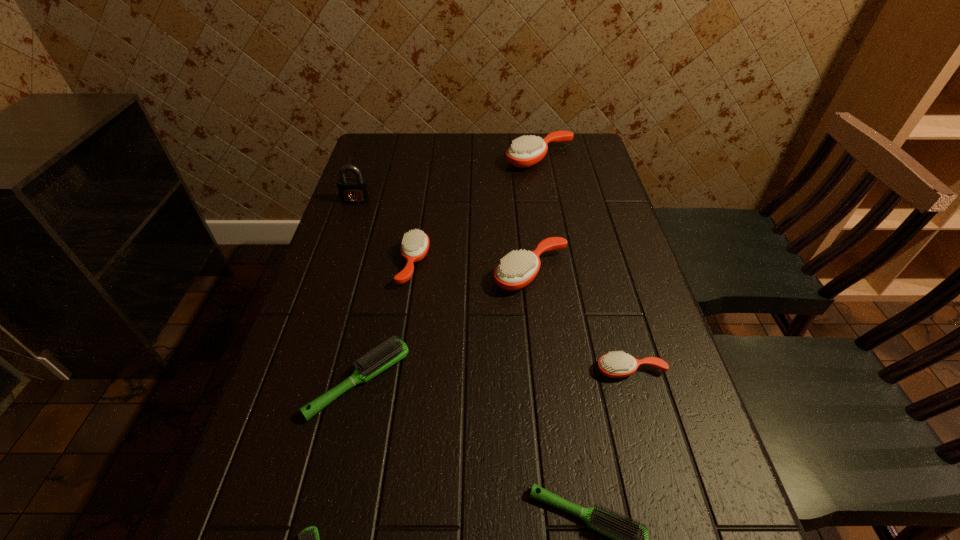
Find the location of `free location at the far edge`. free location at the far edge is located at coordinates (543, 161).

Where is `free space at the left edge of the desktop`? free space at the left edge of the desktop is located at coordinates (321, 429).

In the image, there is a desktop. At what (x,y) coordinates should I click in order to perform the action: click on free space at the right edge. Please return your answer as a coordinate pair (x, y). Looking at the image, I should click on coord(693,477).

Find the location of a particular element. vacant space at the far left corner of the desktop is located at coordinates (386, 140).

Identify the location of free region at the far right corner of the desktop. 602,163.

You are a GUI agent. You are given a task and a screenshot of the screen. Output one action in this format:
    pyautogui.click(x=<x>, y=<y>)
    Task: Click on the vacant area between the farthest light hairbrush and the tallest object
    The height and width of the screenshot is (540, 960).
    Given the screenshot: What is the action you would take?
    pyautogui.click(x=357, y=291)

The image size is (960, 540). Find the location of `vacant point located between the smallest orange hairbrush and the third biggest orange hairbrush`. vacant point located between the smallest orange hairbrush and the third biggest orange hairbrush is located at coordinates (522, 317).

Identify the location of object that is the seventh closest to the seventh nearest object. (629, 539).

This screenshot has height=540, width=960. Identify the location of the closest object to the biggest light hairbrush. (415, 244).

Locate an element on the screen. hairbrush that is the second closest to the biggest orange hairbrush is located at coordinates click(x=415, y=244).